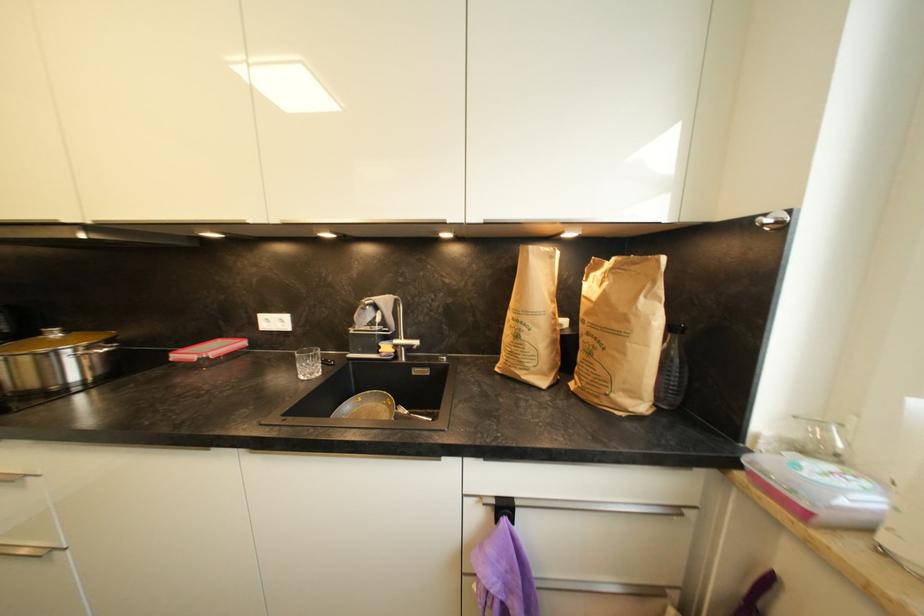
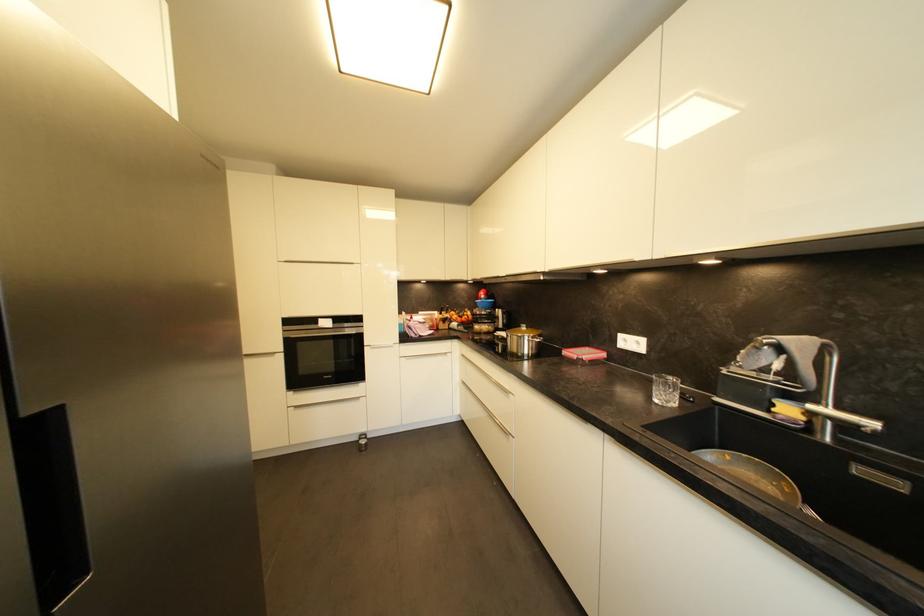
Find the pixel in the second image that matches (x=69, y=334) in the first image.

(531, 330)